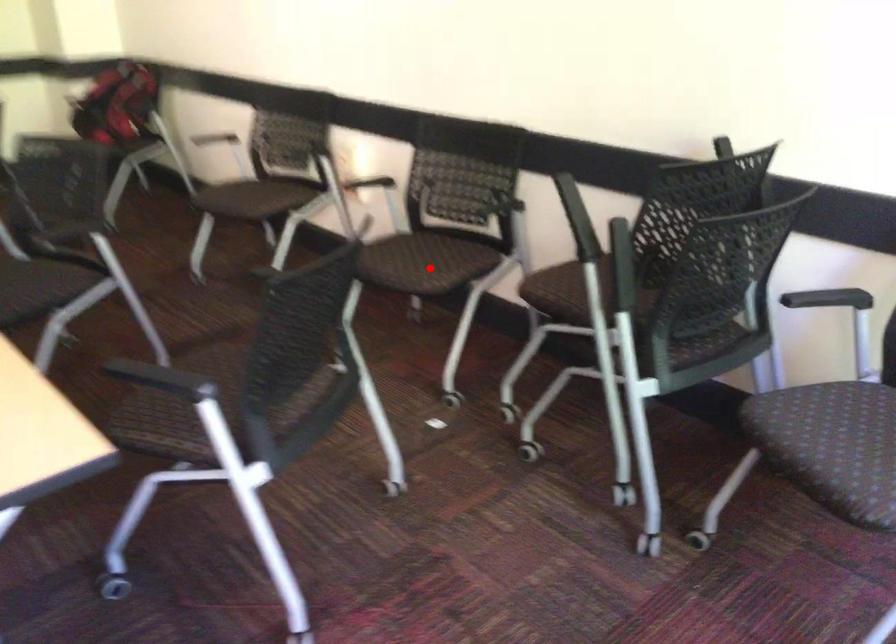
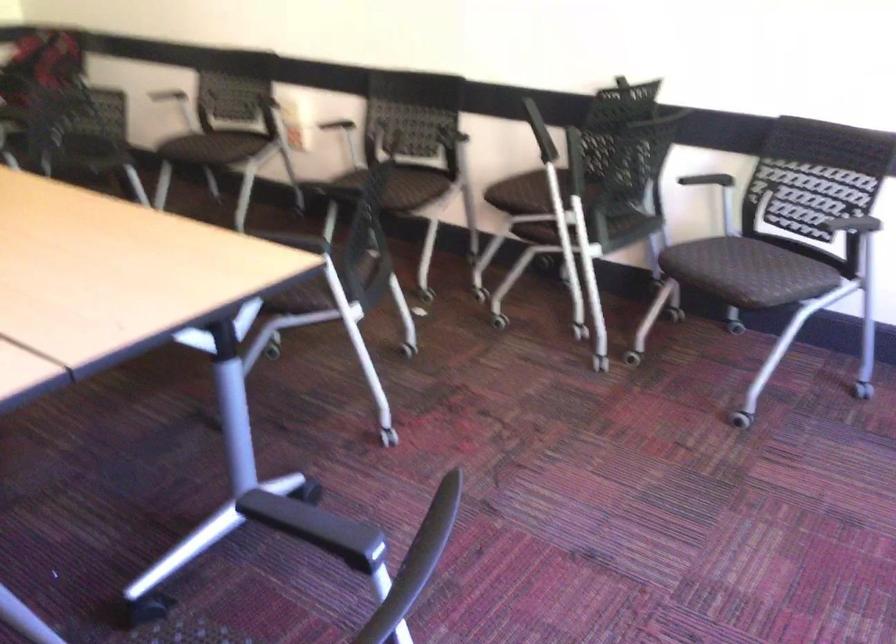
In the second image, find the point that corresponds to the highlighted location in the first image.

(402, 187)